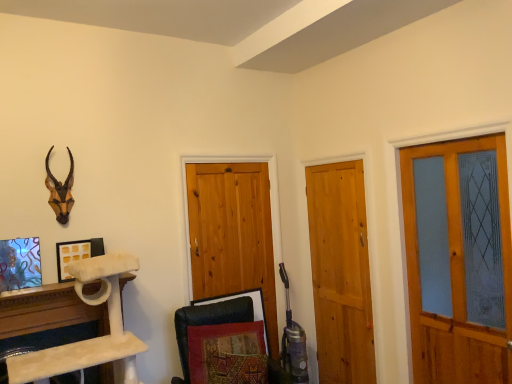
Question: Does white matte picture frame at upper left, the first picture frame when ordered from right to left, come behind matte wooden screen door at right?

Choices:
 (A) yes
 (B) no

Answer: (A)

Question: Is white matte picture frame at upper left, the second picture frame when ordered from left to right, oriented towards matte wooden screen door at right?

Choices:
 (A) no
 (B) yes

Answer: (A)

Question: From the image's perspective, is white matte picture frame at upper left, which appears as the second picture frame when viewed from the front, located above matte wooden screen door at right?

Choices:
 (A) yes
 (B) no

Answer: (A)

Question: Is white matte picture frame at upper left, the second picture frame when ordered from left to right, with matte wooden screen door at right?

Choices:
 (A) no
 (B) yes

Answer: (A)

Question: Is white matte picture frame at upper left, the second picture frame when ordered from left to right, facing away from matte wooden screen door at right?

Choices:
 (A) no
 (B) yes

Answer: (A)

Question: From the image's perspective, is black leather swivel chair at lower center above or below white matte picture frame at upper left, which appears as the second picture frame when viewed from the front?

Choices:
 (A) above
 (B) below

Answer: (B)

Question: Looking at the image, does black leather swivel chair at lower center seem bigger or smaller compared to white matte picture frame at upper left, which appears as the second picture frame when viewed from the front?

Choices:
 (A) small
 (B) big

Answer: (B)

Question: Considering the positions of black leather swivel chair at lower center and white matte picture frame at upper left, the first picture frame when ordered from right to left, in the image, is black leather swivel chair at lower center taller or shorter than white matte picture frame at upper left, the first picture frame when ordered from right to left,?

Choices:
 (A) tall
 (B) short

Answer: (A)

Question: Considering the positions of point (184, 314) and point (89, 243), is point (184, 314) closer or farther from the camera than point (89, 243)?

Choices:
 (A) closer
 (B) farther

Answer: (B)

Question: Is stained glass picture frame at lower left, marked as the first picture frame in a left-to-right arrangement, to the left or to the right of light brown wooden door at center, marked as the 2th barn door in a left-to-right arrangement, in the image?

Choices:
 (A) left
 (B) right

Answer: (A)

Question: Is point (20, 244) closer or farther from the camera than point (314, 258)?

Choices:
 (A) closer
 (B) farther

Answer: (A)

Question: Looking at the image, does stained glass picture frame at lower left, arranged as the 2th picture frame when viewed from the right, seem bigger or smaller compared to light brown wooden door at center, which is counted as the first barn door, starting from the right?

Choices:
 (A) small
 (B) big

Answer: (A)

Question: Is stained glass picture frame at lower left, marked as the first picture frame in a left-to-right arrangement, spatially inside light brown wooden door at center, marked as the 2th barn door in a left-to-right arrangement, or outside of it?

Choices:
 (A) inside
 (B) outside

Answer: (B)

Question: Is white marble cat tree at lower left inside or outside of white matte picture frame at upper left, the first picture frame when ordered from right to left?

Choices:
 (A) outside
 (B) inside

Answer: (A)

Question: In terms of height, does white marble cat tree at lower left look taller or shorter compared to white matte picture frame at upper left, the first picture frame when ordered from right to left?

Choices:
 (A) tall
 (B) short

Answer: (A)